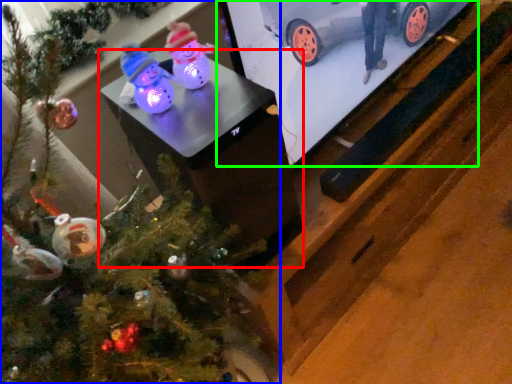
Question: Estimate the real-world distances between objects in this image. Which object is closer to table (highlighted by a red box), christmas tree (highlighted by a blue box) or tv show (highlighted by a green box)?

Choices:
 (A) christmas tree
 (B) tv show

Answer: (A)